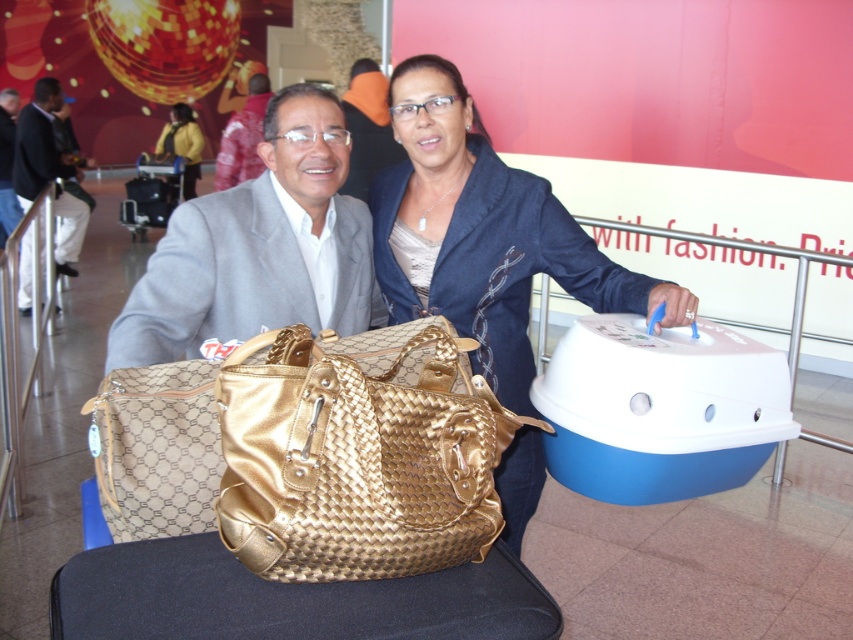
Question: From the image, what is the correct spatial relationship of gold metallic handbag at center in relation to gold shiny handbag at center?

Choices:
 (A) left
 (B) right

Answer: (B)

Question: Which of the following is the farthest from the observer?

Choices:
 (A) (289, 276)
 (B) (186, 189)
 (C) (486, 388)

Answer: (B)

Question: Is gold metallic handbag at center behind gold woven handbag at center?

Choices:
 (A) yes
 (B) no

Answer: (B)

Question: Where is gold metallic handbag at center located in relation to gold woven handbag at center in the image?

Choices:
 (A) below
 (B) above

Answer: (A)

Question: Which point appears closest to the camera in this image?

Choices:
 (A) (311, 184)
 (B) (190, 132)
 (C) (218, 164)

Answer: (A)

Question: Which of these objects is positioned farthest from the brushed metal suitcase at lower left?

Choices:
 (A) gold shiny handbag at center
 (B) metallic gold handbag at center
 (C) yellow fabric jacket at upper left
 (D) brushed metal jacket at left

Answer: (A)